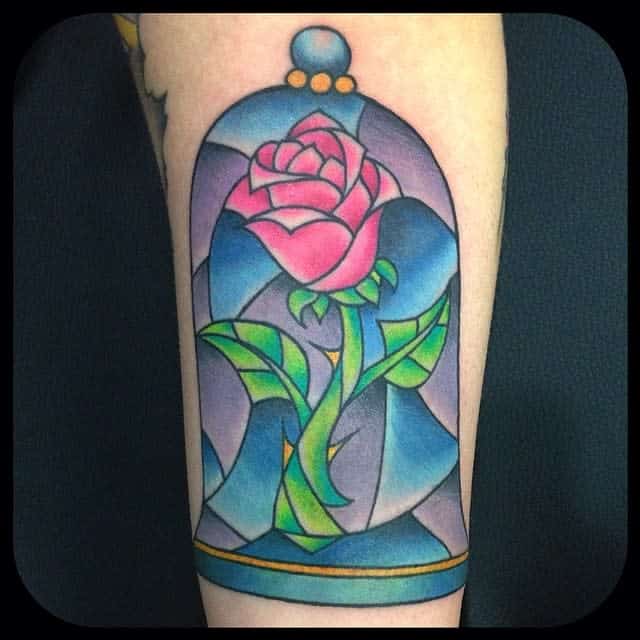
Where is `gold trim`? The height and width of the screenshot is (640, 640). gold trim is located at coordinates (402, 570).